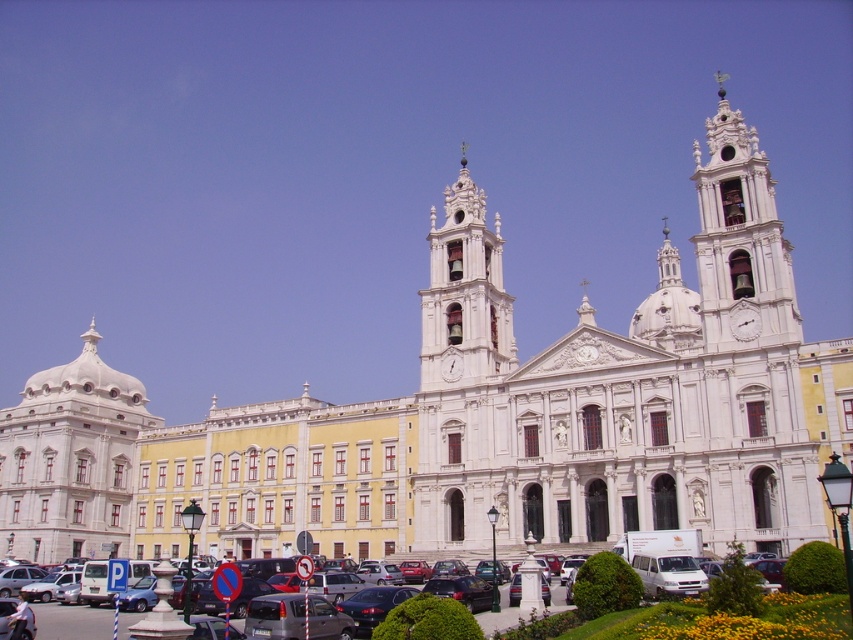
Does white marble dome at left appear over white ornate clock tower at center?

No.

You are a GUI agent. You are given a task and a screenshot of the screen. Output one action in this format:
    pyautogui.click(x=<x>, y=<y>)
    Task: Click on the white marble dome at left
    The image size is (853, 640).
    Given the screenshot: What is the action you would take?
    pyautogui.click(x=70, y=460)

Measure the distance between point (x=463, y=243) and camera.

They are 76.49 meters apart.

Can you confirm if white ornate clock tower at center is bigger than matte black car at center?

Correct, white ornate clock tower at center is larger in size than matte black car at center.

Is point (444, 333) positioned behind point (120, 632)?

Yes, point (444, 333) is farther from viewer.

You are a GUI agent. You are given a task and a screenshot of the screen. Output one action in this format:
    pyautogui.click(x=<x>, y=<y>)
    Task: Click on the white ornate clock tower at center
    The image size is (853, 640).
    Given the screenshot: What is the action you would take?
    pyautogui.click(x=463, y=292)

You are a GUI agent. You are given a task and a screenshot of the screen. Output one action in this format:
    pyautogui.click(x=<x>, y=<y>)
    Task: Click on the white marble dome at left
    
    Given the screenshot: What is the action you would take?
    pyautogui.click(x=70, y=460)

Can you confirm if white marble dome at left is positioned above matte black car at center?

Yes, white marble dome at left is above matte black car at center.

Locate an element on the screen. Image resolution: width=853 pixels, height=640 pixels. white marble dome at left is located at coordinates (70, 460).

The image size is (853, 640). I want to click on white marble dome at left, so [70, 460].